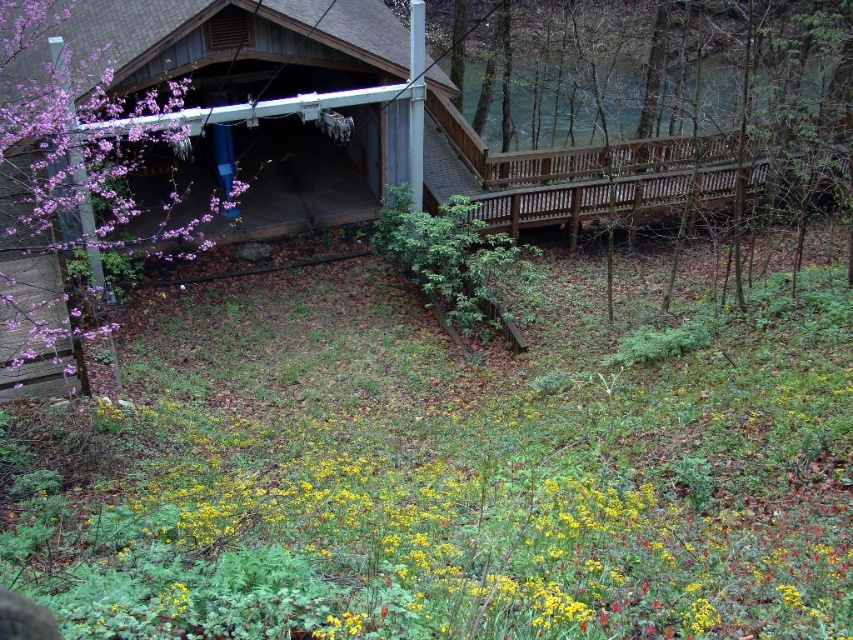
You are planning to install a new flagpole in the scene. Considering the wooden cabin at upper left and the brown wooden porch at right, which location would be safer to place the flagpole to avoid height restrictions?

The wooden cabin at upper left has a greater height compared to the brown wooden porch at right, so placing the flagpole at the brown wooden porch at right would be safer to avoid height restrictions.